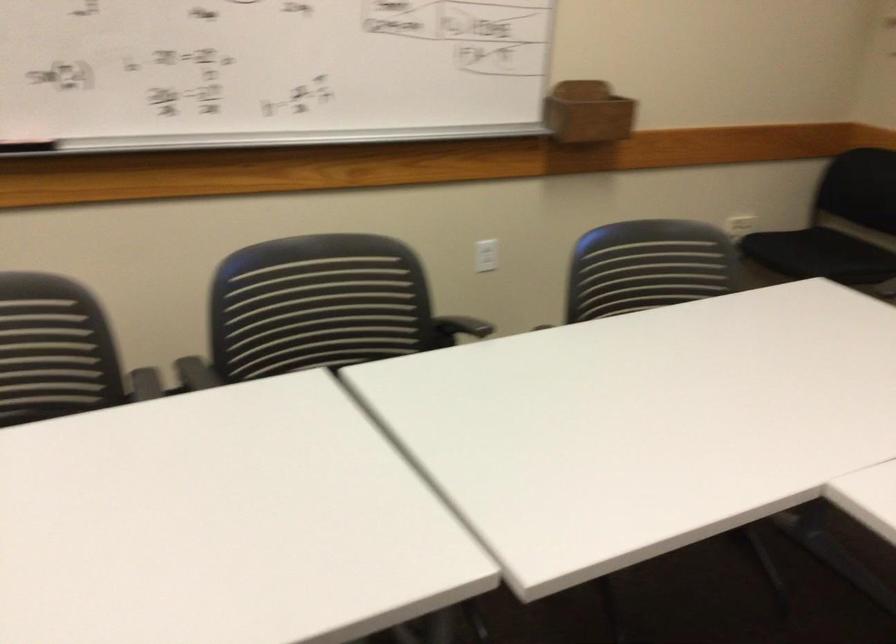
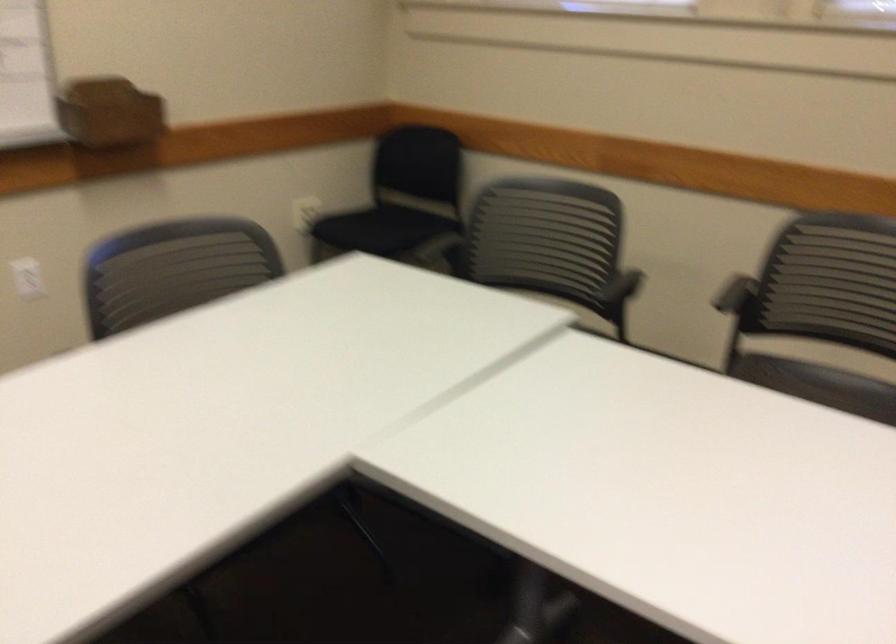
Question: The camera is either moving clockwise (left) or counter-clockwise (right) around the object. The first image is from the beginning of the video and the second image is from the end. Is the camera moving left or right when shooting the video?

Choices:
 (A) Left
 (B) Right

Answer: (A)